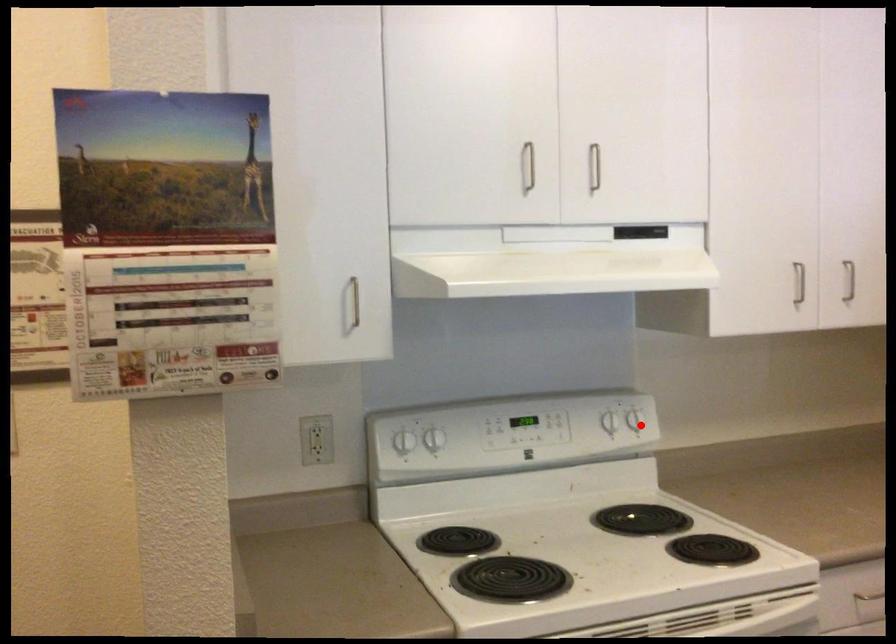
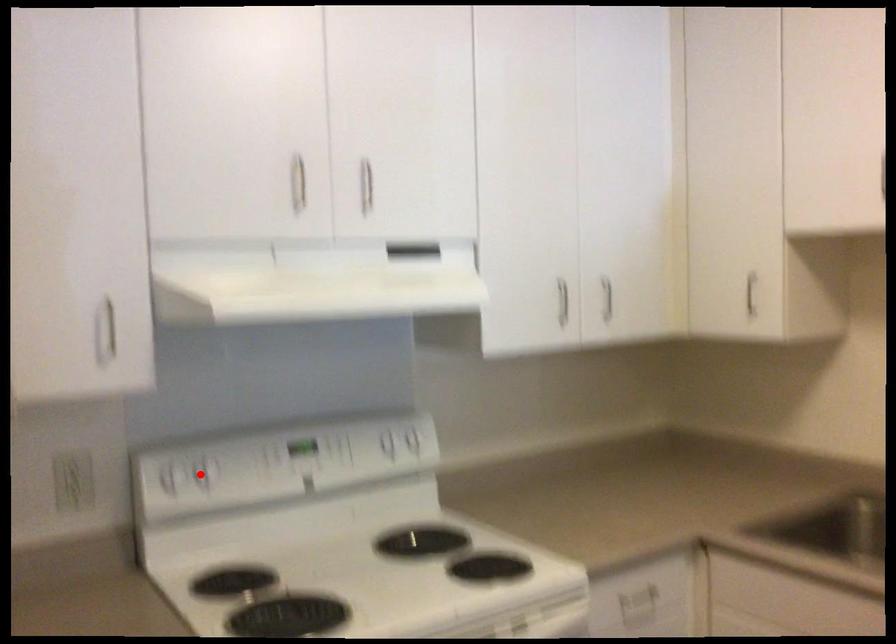
I am providing you with two images of the same scene from different viewpoints. A red point is marked on the first image and another point is marked on the second image. Is the marked point in image1 the same physical position as the marked point in image2?

No